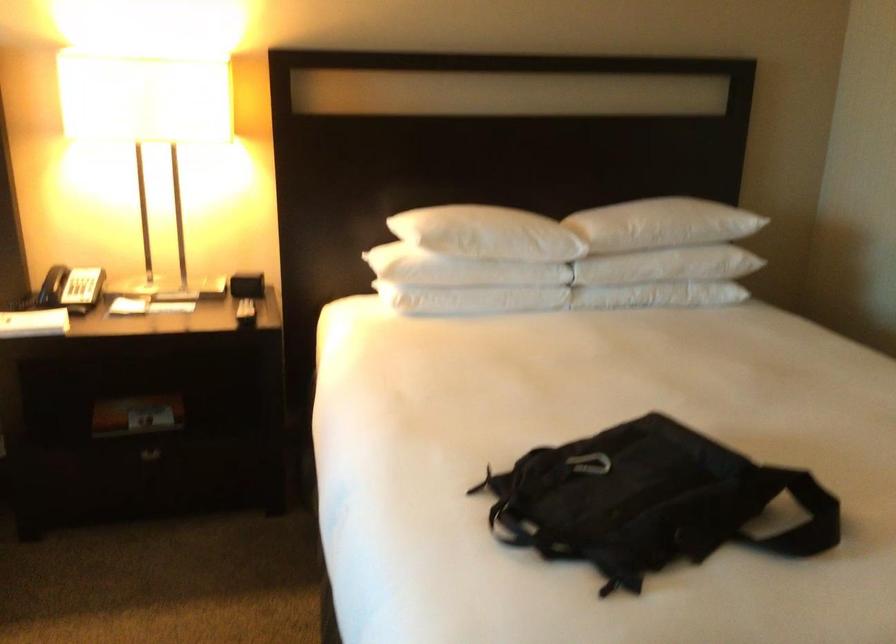
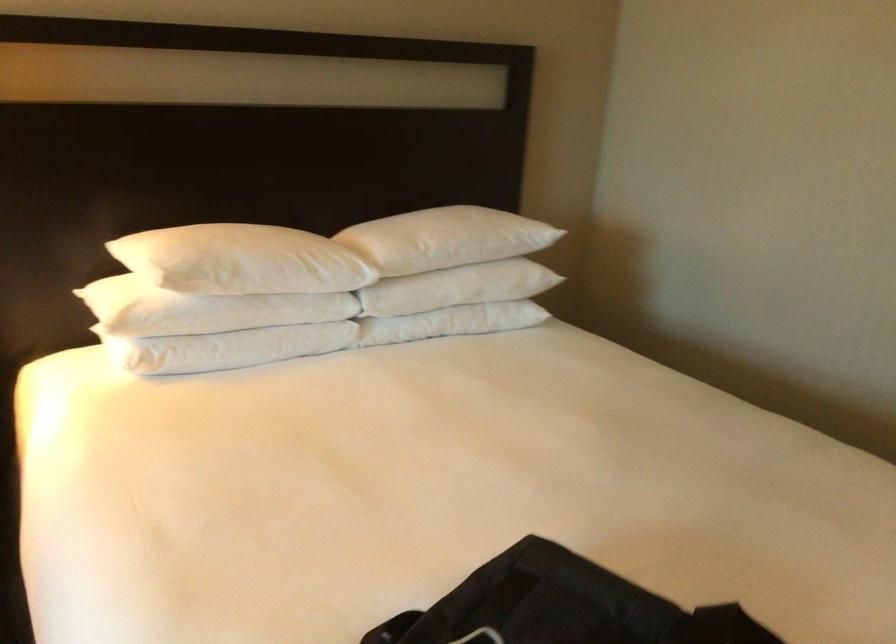
Find the pixel in the second image that matches the point at 455,223 in the first image.

(211, 254)